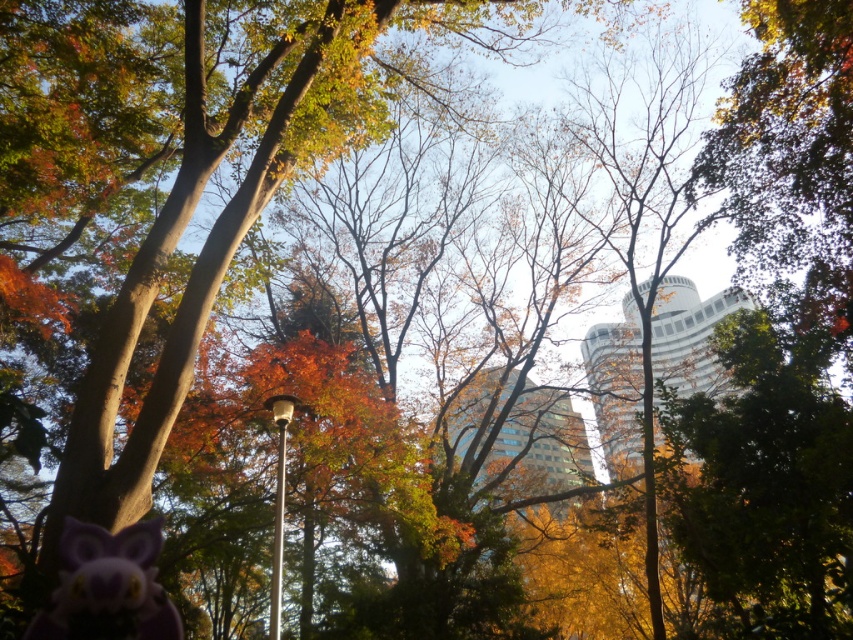
You are an architect analyzing the urban landscape in the image. You notice the white glossy tower at center and the glassy blue skyscraper at center. Which structure is positioned higher in the scene?

The white glossy tower at center is positioned higher than the glassy blue skyscraper at center according to the description.

You are an architect analyzing the urban layout of this autumn scene. You notice the white glossy tower at center and the glassy blue skyscraper at center. Based on their positions, which one is located to the east if the sun is shining from the west?

The white glossy tower at center is to the right of the glassy blue skyscraper at center. Since the sun is coming from the west, shadows would be cast to the east. If the white glossy tower at center is to the right of the glassy blue skyscraper at center, it would be positioned eastward, as it would be in the direction the sunlight is coming from, thus not in shadow. Therefore, the white glossy tower at center is likely located to the east.

You are standing in the autumn scene and want to take a photo of the white glossy tower at center. If your camera has a maximum focus range of 30 feet, will you need to move closer to the tower to capture it clearly?

The white glossy tower at center is 35.31 feet away from the viewer, which exceeds the camera maximum focus range of 30 feet. Therefore, you need to move closer to the tower to capture it clearly.